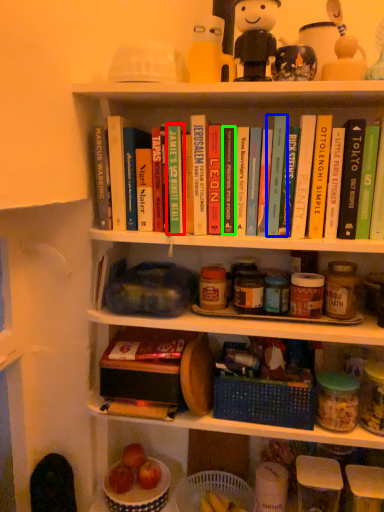
Question: Which object is positioned closest to book (highlighted by a red box)? Select from book (highlighted by a blue box) and book (highlighted by a green box).

Choices:
 (A) book
 (B) book

Answer: (B)